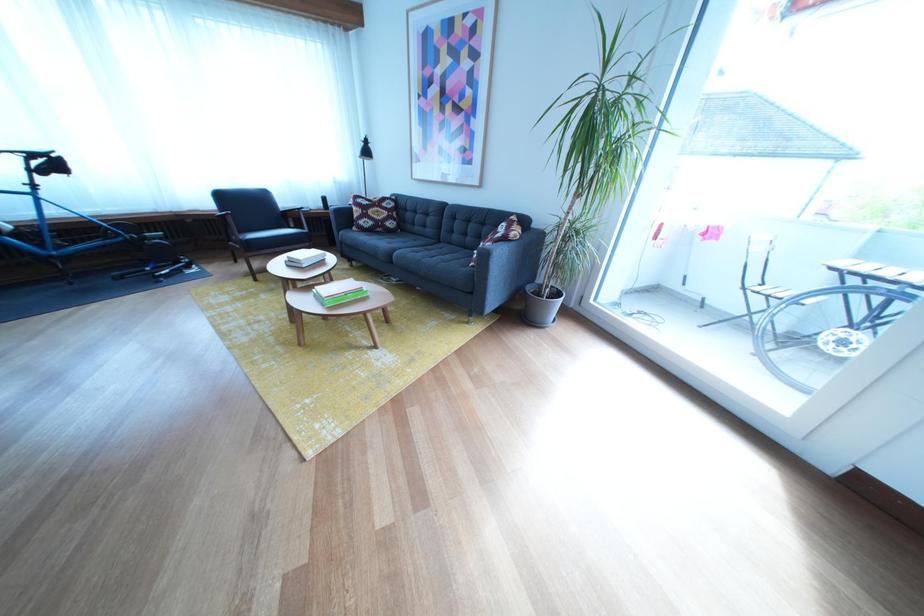
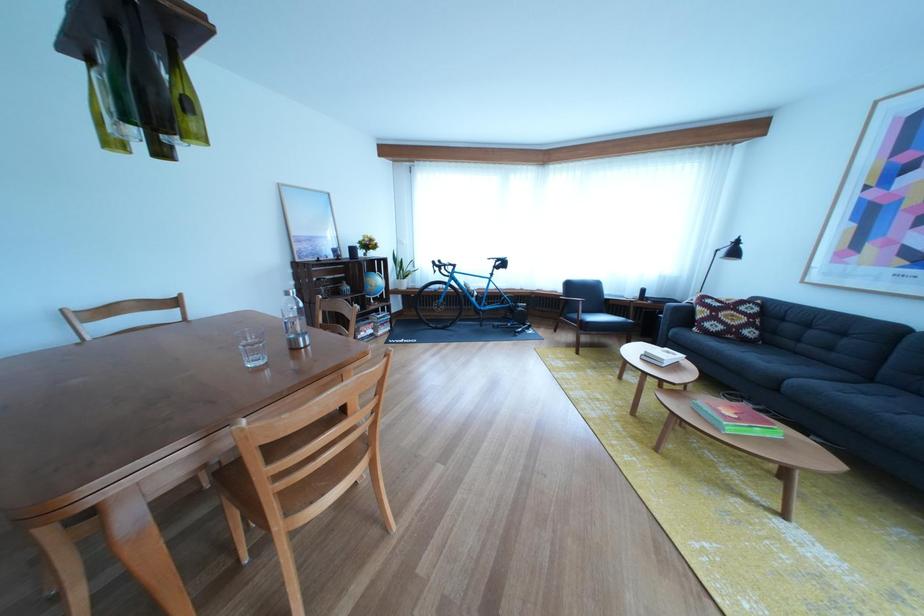
Where in the second image is the point corresponding to (x=398, y=220) from the first image?

(757, 325)